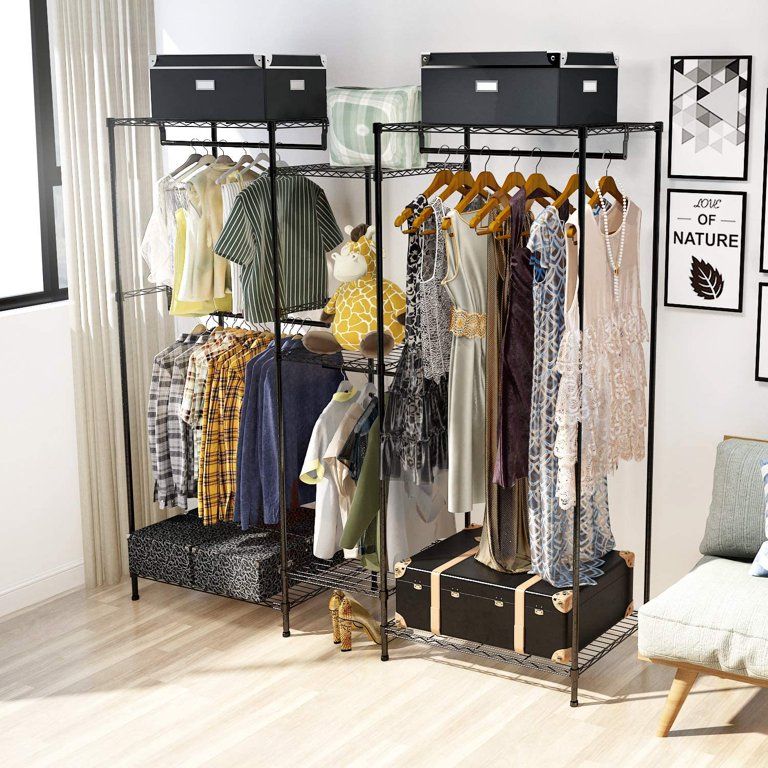
Locate an element on the screen. This screenshot has height=768, width=768. hangers left side is located at coordinates tap(277, 147), tap(259, 151), tap(243, 150), tap(220, 151), tap(204, 151), tap(193, 141).